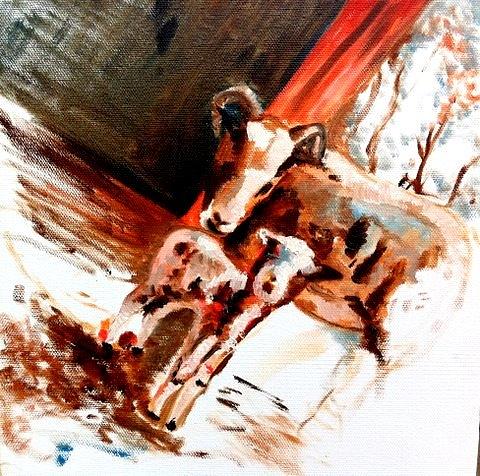
Locate an element on the screen. This screenshot has height=476, width=480. canvas is located at coordinates (422, 449).